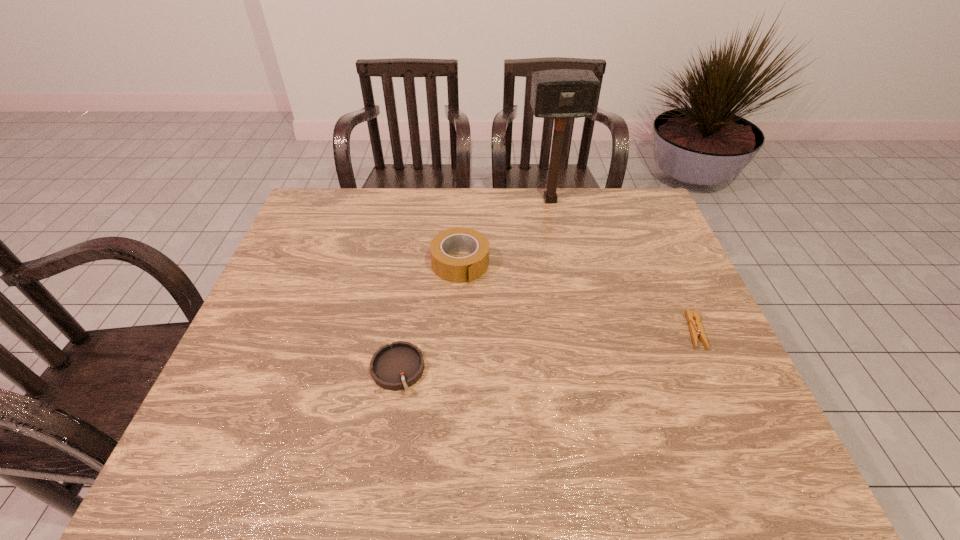
You are a GUI agent. You are given a task and a screenshot of the screen. Output one action in this format:
    pyautogui.click(x=<x>, y=<y>)
    Task: Click on the vacant area that lies between the third tallest object and the second tallest object
    Image resolution: width=960 pixels, height=540 pixels.
    Given the screenshot: What is the action you would take?
    pyautogui.click(x=429, y=317)

The image size is (960, 540). In order to click on vacant area that lies between the farthest object and the rightmost object in this screenshot , I will do `click(622, 266)`.

I want to click on free space between the clothespin and the third shortest object, so click(x=578, y=297).

Where is `object that is the second closest one to the rightmost object`? The height and width of the screenshot is (540, 960). object that is the second closest one to the rightmost object is located at coordinates (455, 269).

Identify which object is the third nearest to the second tallest object. Please provide its 2D coordinates. Your answer should be formatted as a tuple, i.e. [(x, y)], where the tuple contains the x and y coordinates of a point satisfying the conditions above.

[(696, 329)]

Where is `free space that satisfies the following two spatial constraints: 1. on the front side of the third shortest object; 2. on the left side of the clothespin`? free space that satisfies the following two spatial constraints: 1. on the front side of the third shortest object; 2. on the left side of the clothespin is located at coordinates (457, 331).

Identify the location of vacant space that satisfies the following two spatial constraints: 1. on the back side of the third shortest object; 2. on the right side of the second shortest object. The image size is (960, 540). (415, 264).

Locate an element on the screen. The width and height of the screenshot is (960, 540). blank space that satisfies the following two spatial constraints: 1. on the back side of the third nearest object; 2. on the left side of the third tallest object is located at coordinates (415, 264).